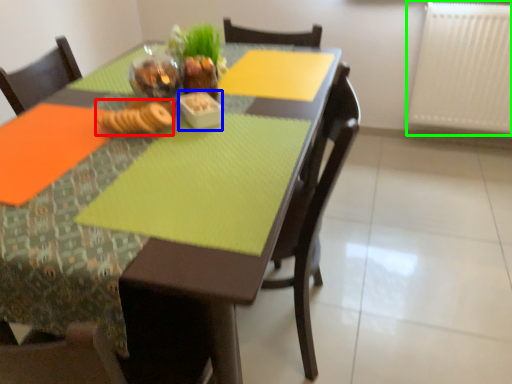
Question: Estimate the real-world distances between objects in this image. Which object is closer to food (highlighted by a red box), tableware (highlighted by a blue box) or radiator (highlighted by a green box)?

Choices:
 (A) tableware
 (B) radiator

Answer: (A)